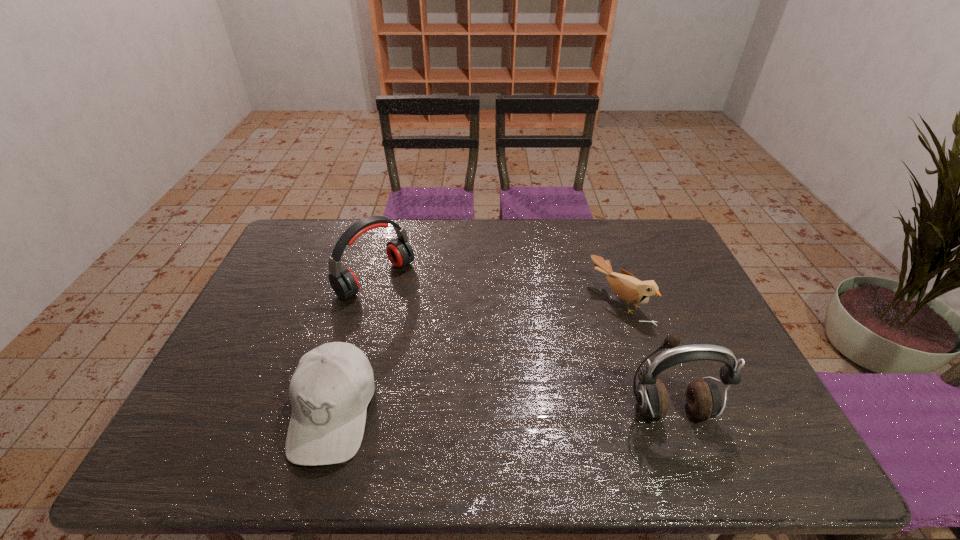
Identify the location of empty space that is in between the baseball cap and the right earphone. (501, 411).

Find the location of a particular element. The width and height of the screenshot is (960, 540). object that can be found as the third closest to the taller earphone is located at coordinates (343, 281).

This screenshot has height=540, width=960. Identify the location of the second closest object relative to the right earphone. (330, 390).